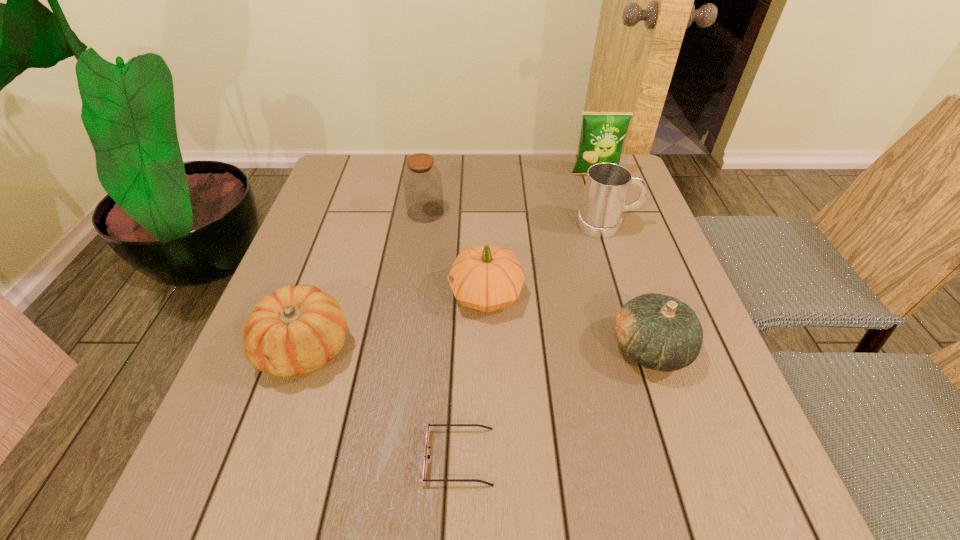
Where is `crisp (potato chip) located at the right edge`? This screenshot has height=540, width=960. crisp (potato chip) located at the right edge is located at coordinates (x=603, y=133).

Where is `mug located at the right edge`? mug located at the right edge is located at coordinates (607, 184).

At what (x,y) coordinates should I click in order to perform the action: click on gourd located at the right edge. Please return your answer as a coordinate pair (x, y). The height and width of the screenshot is (540, 960). Looking at the image, I should click on (659, 332).

I want to click on object positioned at the far right corner, so click(x=603, y=133).

Locate an element on the screen. free space at the far edge of the desktop is located at coordinates (478, 166).

Image resolution: width=960 pixels, height=540 pixels. In order to click on vacant point at the near edge in this screenshot , I will do `click(468, 505)`.

In order to click on vacant space at the left edge of the desktop in this screenshot , I will do `click(296, 276)`.

In the image, there is a desktop. Where is `vacant space at the right edge`? vacant space at the right edge is located at coordinates (707, 440).

What are the coordinates of `vacant region at the far left corner of the desktop` in the screenshot? It's located at (379, 187).

The height and width of the screenshot is (540, 960). Find the location of `vacant space at the far right corner of the desktop`. vacant space at the far right corner of the desktop is located at coordinates (580, 183).